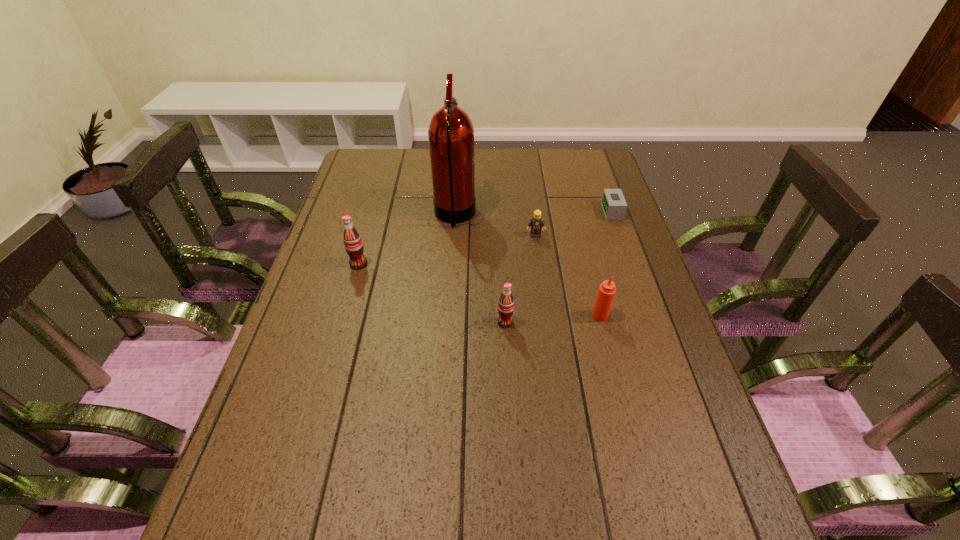
What are the coordinates of `the second object from left to right` in the screenshot? It's located at (451, 133).

This screenshot has width=960, height=540. I want to click on free spot located on the right of the taller soda, so click(x=414, y=264).

Where is `free location located on the left of the shorter soda`? Image resolution: width=960 pixels, height=540 pixels. free location located on the left of the shorter soda is located at coordinates (367, 322).

The image size is (960, 540). I want to click on vacant space positioned in front of the fifth tallest object, so click(x=547, y=321).

This screenshot has width=960, height=540. Find the location of `free space located on the front-facing side of the rightmost object`. free space located on the front-facing side of the rightmost object is located at coordinates (556, 212).

Where is `free space located on the front-facing side of the rightmost object`? free space located on the front-facing side of the rightmost object is located at coordinates (568, 212).

At what (x,y) coordinates should I click in order to perform the action: click on vacant space located 0.090m on the front-facing side of the rightmost object. Please return your answer as a coordinate pair (x, y). This screenshot has height=540, width=960. Looking at the image, I should click on (575, 212).

Locate an element on the screen. vacant space located 0.380m on the back of the second object from right to left is located at coordinates (576, 218).

What are the coordinates of `free space located 0.370m on the front-facing side of the fire extinguisher` in the screenshot? It's located at (593, 216).

Locate an element on the screen. object that is at the left edge is located at coordinates [352, 240].